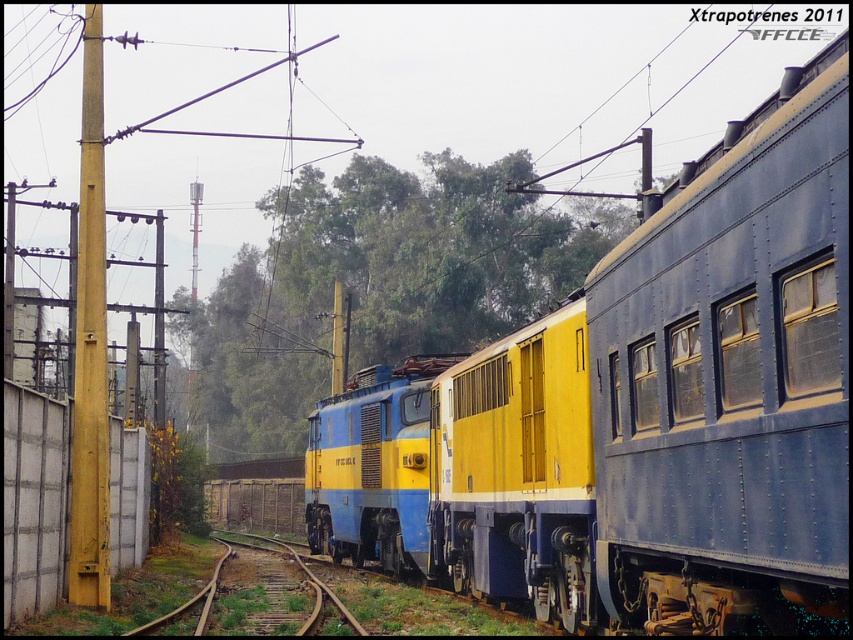
You are a train engineer who needs to ensure the yellow painted metal pole at left is positioned safely relative to the brown wooden train track at center. Based on the scene, is the pole above or below the track?

The yellow painted metal pole at left is above the brown wooden train track at center, so it is positioned safely above the track.

You are standing on the railway platform and see two points marked on the train. The first point is at point (312, 340) and the second is at point (91, 513). Which point is closer to you?

Point (312, 340) is further to the viewer than point (91, 513), so the point closer to you is point (91, 513).